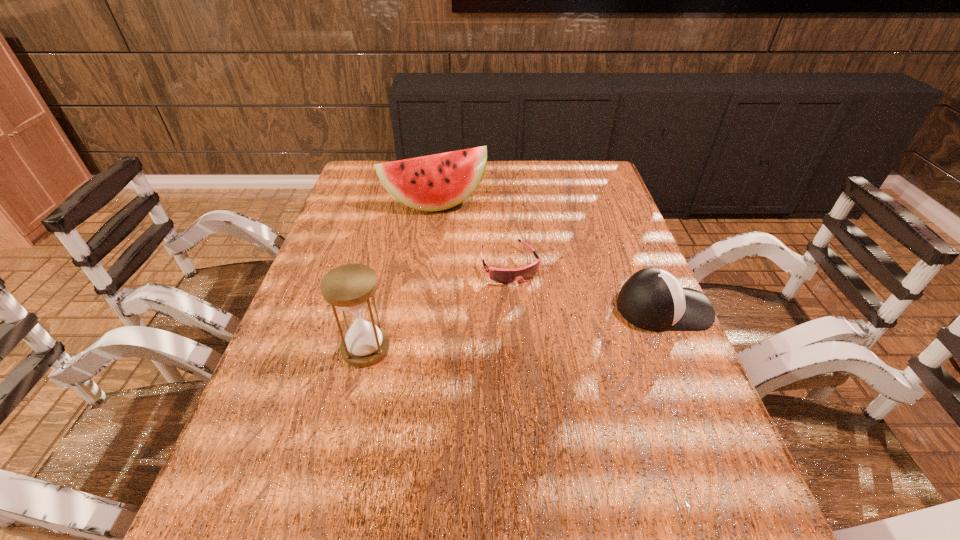
In order to click on hourglass in this screenshot , I will do `click(349, 287)`.

Locate an element on the screen. The image size is (960, 540). the second shortest object is located at coordinates (652, 299).

Where is `the rightmost object`? Image resolution: width=960 pixels, height=540 pixels. the rightmost object is located at coordinates (652, 299).

This screenshot has height=540, width=960. Find the location of `the farthest object`. the farthest object is located at coordinates (437, 182).

You are a GUI agent. You are given a task and a screenshot of the screen. Output one action in this format:
    pyautogui.click(x=<x>, y=<y>)
    Task: Click on the goggles
    The height and width of the screenshot is (540, 960).
    Given the screenshot: What is the action you would take?
    pyautogui.click(x=504, y=276)

I want to click on the second farthest object, so click(x=504, y=276).

The image size is (960, 540). I want to click on vacant space situated 0.250m on the back of the hourglass, so click(x=387, y=261).

Where is `vacant region located 0.120m on the outer rind of the watermelon`? vacant region located 0.120m on the outer rind of the watermelon is located at coordinates (456, 238).

Find the location of a particular element. The image size is (960, 540). vacant space situated 0.220m on the outer rind of the watermelon is located at coordinates (465, 259).

This screenshot has height=540, width=960. I want to click on blank space located 0.400m on the outer rind of the watermelon, so click(482, 303).